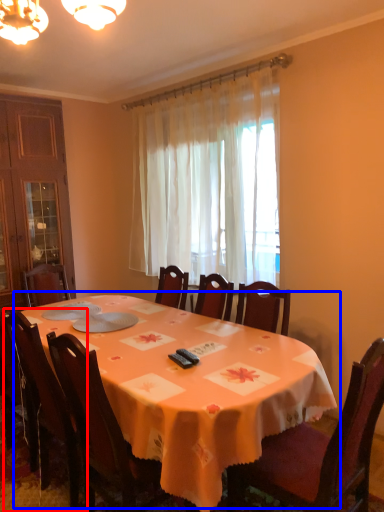
Question: Which object is further to the camera taking this photo, chair (highlighted by a red box) or table (highlighted by a blue box)?

Choices:
 (A) chair
 (B) table

Answer: (A)